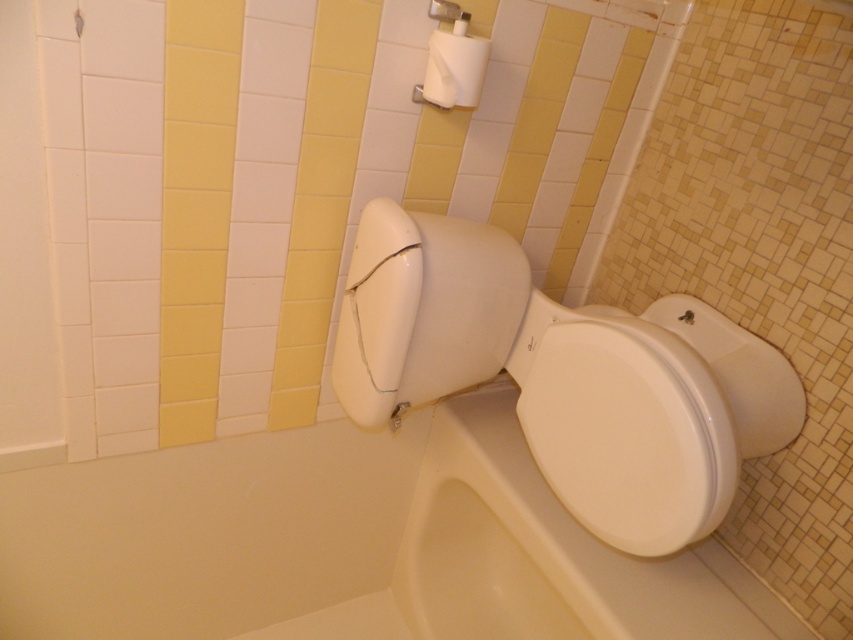
Looking at this image, you are a repair technician standing at point [347,545] in the bathroom. You need to reach the white glossy bathtub at lower left. Is the point where you are standing the same as the location of the bathtub?

The point [347,545] is where the white glossy bathtub at lower left is located, so yes, the technician is standing at the same location as the bathtub.

Based on the photo, you are a home inspector assessing the bathroom. You need to determine if the white glossy toilet bowl at center can accommodate the white matte toilet paper at upper center. Can it fit based on their sizes?

The white glossy toilet bowl at center is bigger than the white matte toilet paper at upper center, so yes, it can accommodate the toilet paper.